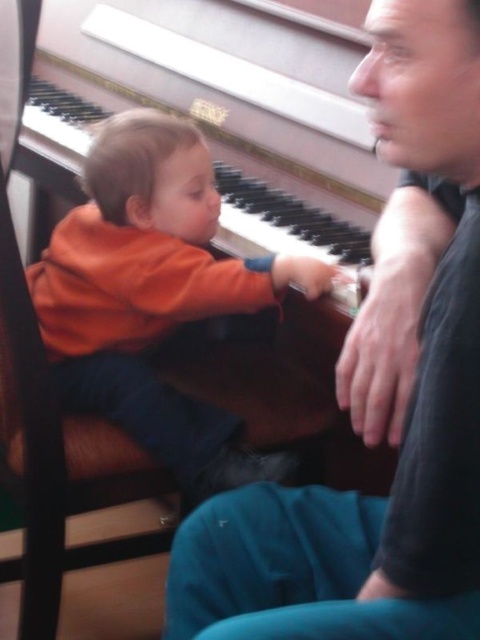
Is matte black shirt at center bigger than orange soft fabric toddler at center?

Incorrect, matte black shirt at center is not larger than orange soft fabric toddler at center.

Between point (184, 618) and point (326, 288), which one is positioned behind?

Positioned behind is point (326, 288).

Identify the location of matte black shirt at center. (408, 403).

Locate an element on the screen. matte black shirt at center is located at coordinates (408, 403).